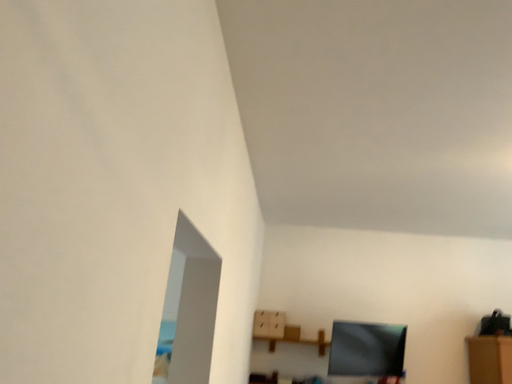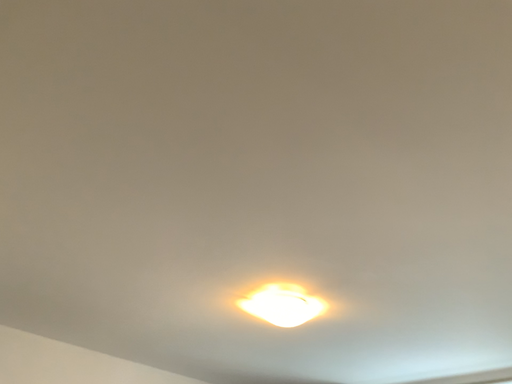
Question: Which way did the camera rotate in the video?

Choices:
 (A) rotated upward
 (B) rotated downward

Answer: (A)